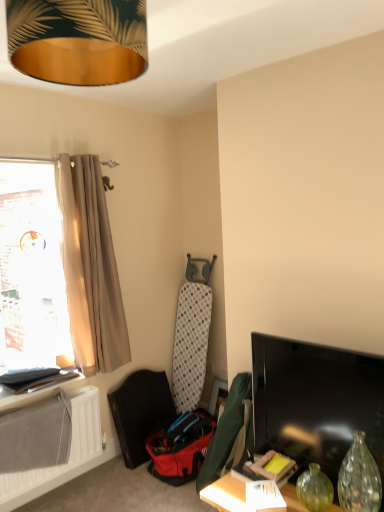
Question: From the image's perspective, does gold metallic lampshade at upper center appear lower than matte green picture frame at lower right?

Choices:
 (A) no
 (B) yes

Answer: (A)

Question: Is matte green picture frame at lower right a part of gold metallic lampshade at upper center?

Choices:
 (A) yes
 (B) no

Answer: (B)

Question: Is gold metallic lampshade at upper center not close to matte green picture frame at lower right?

Choices:
 (A) no
 (B) yes

Answer: (B)

Question: From a real-world perspective, does gold metallic lampshade at upper center sit lower than matte green picture frame at lower right?

Choices:
 (A) no
 (B) yes

Answer: (A)

Question: Can you confirm if gold metallic lampshade at upper center is positioned to the right of matte green picture frame at lower right?

Choices:
 (A) yes
 (B) no

Answer: (B)

Question: Based on their positions, is white matte radiator at lower left located to the left or right of matte green picture frame at lower right?

Choices:
 (A) left
 (B) right

Answer: (A)

Question: In terms of height, does white matte radiator at lower left look taller or shorter compared to matte green picture frame at lower right?

Choices:
 (A) tall
 (B) short

Answer: (A)

Question: Is white matte radiator at lower left wider or thinner than matte green picture frame at lower right?

Choices:
 (A) wide
 (B) thin

Answer: (A)

Question: Is white matte radiator at lower left situated inside matte green picture frame at lower right or outside?

Choices:
 (A) outside
 (B) inside

Answer: (A)

Question: In the image, is black glossy tv at right on the left side or the right side of translucent beige curtain at left?

Choices:
 (A) left
 (B) right

Answer: (B)

Question: Considering the positions of black glossy tv at right and translucent beige curtain at left in the image, is black glossy tv at right taller or shorter than translucent beige curtain at left?

Choices:
 (A) short
 (B) tall

Answer: (A)

Question: From a real-world perspective, relative to translucent beige curtain at left, is black glossy tv at right vertically above or below?

Choices:
 (A) below
 (B) above

Answer: (A)

Question: Considering the positions of point (380, 379) and point (8, 342), is point (380, 379) closer or farther from the camera than point (8, 342)?

Choices:
 (A) farther
 (B) closer

Answer: (B)

Question: Considering their positions, is matte black shelf at lower left located in front of or behind black glossy tv at right?

Choices:
 (A) front
 (B) behind

Answer: (B)

Question: In terms of height, does matte black shelf at lower left look taller or shorter compared to black glossy tv at right?

Choices:
 (A) tall
 (B) short

Answer: (B)